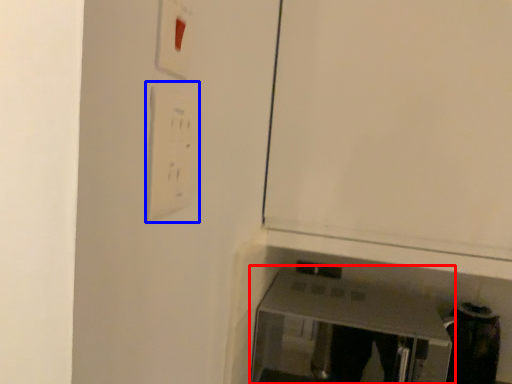
Question: Among these objects, which one is farthest to the camera, furniture (highlighted by a red box) or light switch (highlighted by a blue box)?

Choices:
 (A) furniture
 (B) light switch

Answer: (A)